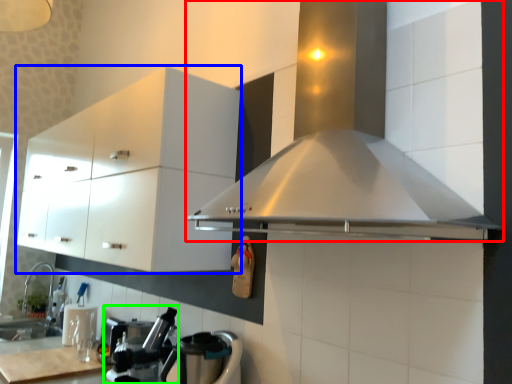
Question: Which object is the closest to the home appliance (highlighted by a red box)? Choose among these: cabinetry (highlighted by a blue box) or coffee machine (highlighted by a green box).

Choices:
 (A) cabinetry
 (B) coffee machine

Answer: (A)